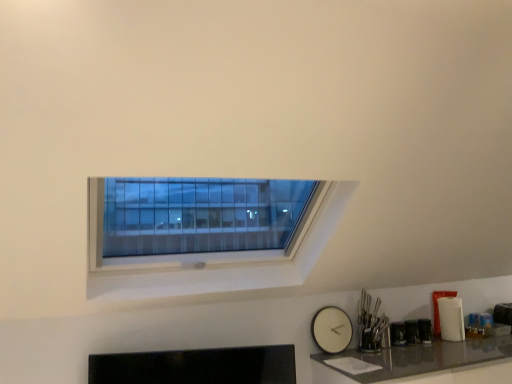
Where is `shiny gray countertop at lower right`? shiny gray countertop at lower right is located at coordinates (426, 364).

In order to face shiny gray countertop at lower right, should I rotate leftwards or rightwards?

Turn right by 25.358 degrees to look at shiny gray countertop at lower right.

The image size is (512, 384). What do you see at coordinates (426, 364) in the screenshot?
I see `shiny gray countertop at lower right` at bounding box center [426, 364].

This screenshot has width=512, height=384. Describe the element at coordinates (331, 329) in the screenshot. I see `white matte clock at lower right` at that location.

Locate an element on the screen. white matte clock at lower right is located at coordinates (331, 329).

The height and width of the screenshot is (384, 512). I want to click on shiny gray countertop at lower right, so click(x=426, y=364).

Considering the positions of objects shiny gray countertop at lower right and white matte clock at lower right in the image provided, who is more to the left, shiny gray countertop at lower right or white matte clock at lower right?

Positioned to the left is white matte clock at lower right.

Relative to white matte clock at lower right, is shiny gray countertop at lower right in front or behind?

Visually, shiny gray countertop at lower right is located in front of white matte clock at lower right.

Considering the positions of points (473, 370) and (338, 323), is point (473, 370) farther from camera compared to point (338, 323)?

No, (473, 370) is closer to viewer.

From the image's perspective, is shiny gray countertop at lower right positioned above or below white matte clock at lower right?

From the image's perspective, shiny gray countertop at lower right appears below white matte clock at lower right.

Looking at this image, from a real-world perspective, who is located higher, shiny gray countertop at lower right or white matte clock at lower right?

white matte clock at lower right.

Which object is thinner, shiny gray countertop at lower right or white matte clock at lower right?

Thinner between the two is white matte clock at lower right.

From the picture: Is shiny gray countertop at lower right taller or shorter than white matte clock at lower right?

In the image, shiny gray countertop at lower right appears to be taller than white matte clock at lower right.

Considering the relative sizes of shiny gray countertop at lower right and white matte clock at lower right in the image provided, is shiny gray countertop at lower right smaller than white matte clock at lower right?

No.

Is white matte clock at lower right completely or partially inside shiny gray countertop at lower right?

No, white matte clock at lower right is not inside shiny gray countertop at lower right.

Is shiny gray countertop at lower right positioned far away from white matte clock at lower right?

Actually, shiny gray countertop at lower right and white matte clock at lower right are a little close together.

Is white matte clock at lower right at the back of shiny gray countertop at lower right?

That's not correct — shiny gray countertop at lower right is not looking away from white matte clock at lower right.

How many degrees apart are the facing directions of shiny gray countertop at lower right and white matte clock at lower right?

The angle between the facing direction of shiny gray countertop at lower right and the facing direction of white matte clock at lower right is 0.54 degrees.

Looking at this image, how far apart are shiny gray countertop at lower right and white matte clock at lower right?

shiny gray countertop at lower right and white matte clock at lower right are 15.01 inches apart.

The height and width of the screenshot is (384, 512). I want to click on counter top lying in front of the white matte clock at lower right, so click(x=426, y=364).

Which is more to the left, white matte clock at lower right or shiny gray countertop at lower right?

white matte clock at lower right.

From the picture: In the image, is white matte clock at lower right positioned in front of or behind shiny gray countertop at lower right?

Clearly, white matte clock at lower right is behind shiny gray countertop at lower right.

Considering the points (346, 321) and (503, 371), which point is in front, point (346, 321) or point (503, 371)?

The point (503, 371) is in front.

From the image's perspective, would you say white matte clock at lower right is positioned over shiny gray countertop at lower right?

Yes, from the image's perspective, white matte clock at lower right is above shiny gray countertop at lower right.

From a real-world perspective, who is located higher, white matte clock at lower right or shiny gray countertop at lower right?

In real-world perspective, white matte clock at lower right is above.

Looking at their sizes, would you say white matte clock at lower right is wider or thinner than shiny gray countertop at lower right?

In the image, white matte clock at lower right appears to be more narrow than shiny gray countertop at lower right.

Considering the sizes of objects white matte clock at lower right and shiny gray countertop at lower right in the image provided, who is taller, white matte clock at lower right or shiny gray countertop at lower right?

shiny gray countertop at lower right.

Considering the relative sizes of white matte clock at lower right and shiny gray countertop at lower right in the image provided, is white matte clock at lower right bigger than shiny gray countertop at lower right?

No.

Is white matte clock at lower right situated inside shiny gray countertop at lower right or outside?

white matte clock at lower right exists outside the volume of shiny gray countertop at lower right.

Is there a large distance between white matte clock at lower right and shiny gray countertop at lower right?

No, white matte clock at lower right is not far from shiny gray countertop at lower right.

Is white matte clock at lower right oriented away from shiny gray countertop at lower right?

white matte clock at lower right does not have its back to shiny gray countertop at lower right.

Can you tell me how much white matte clock at lower right and shiny gray countertop at lower right differ in facing direction?

The facing directions of white matte clock at lower right and shiny gray countertop at lower right are 0.54 degrees apart.

Where is `clock behind the shiny gray countertop at lower right`? clock behind the shiny gray countertop at lower right is located at coordinates (331, 329).

Find the location of a particular element. The width and height of the screenshot is (512, 384). clock that appears on the left of shiny gray countertop at lower right is located at coordinates tap(331, 329).

Identify the location of counter top that is in front of the white matte clock at lower right. The width and height of the screenshot is (512, 384). pyautogui.click(x=426, y=364).